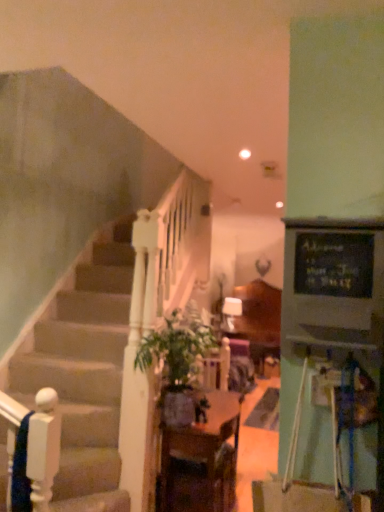
Question: Based on their sizes in the image, would you say green leafy plant at center is bigger or smaller than wooden table at center?

Choices:
 (A) big
 (B) small

Answer: (B)

Question: Is green leafy plant at center inside or outside of wooden table at center?

Choices:
 (A) inside
 (B) outside

Answer: (B)

Question: Relative to wooden table at center, is green leafy plant at center in front or behind?

Choices:
 (A) front
 (B) behind

Answer: (A)

Question: From the image's perspective, is wooden table at center located above or below green leafy plant at center?

Choices:
 (A) above
 (B) below

Answer: (B)

Question: In terms of height, does wooden table at center look taller or shorter compared to green leafy plant at center?

Choices:
 (A) short
 (B) tall

Answer: (B)

Question: In terms of size, does wooden table at center appear bigger or smaller than green leafy plant at center?

Choices:
 (A) small
 (B) big

Answer: (B)

Question: Considering the relative positions of wooden table at center and green leafy plant at center in the image provided, is wooden table at center to the left or to the right of green leafy plant at center?

Choices:
 (A) right
 (B) left

Answer: (A)